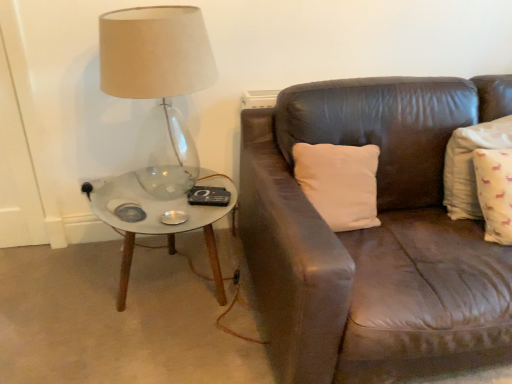
At what (x,y) coordinates should I click in order to perform the action: click on free point in front of white marble coffee table at left. Please return your answer as a coordinate pair (x, y). This screenshot has height=384, width=512. Looking at the image, I should click on (150, 353).